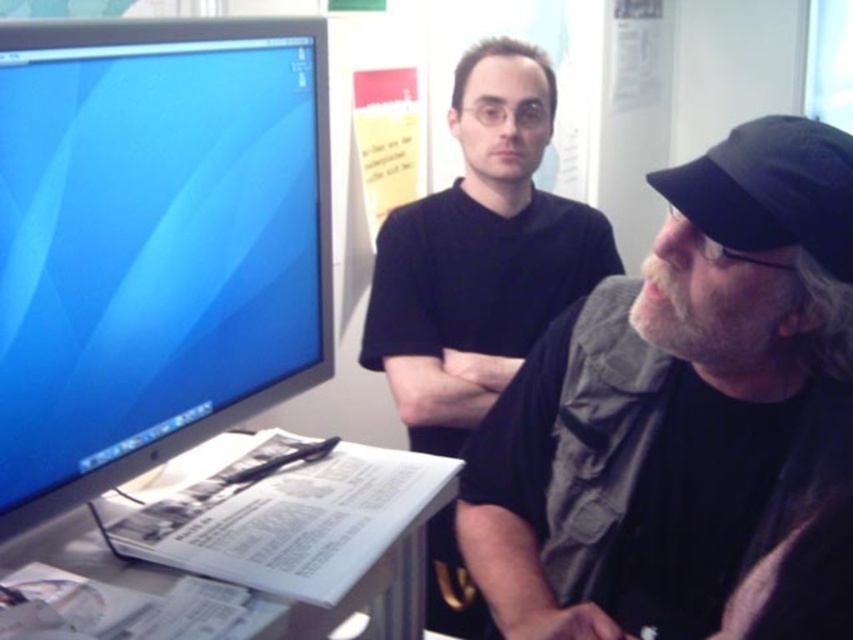
Is dark gray fabric shirt at center shorter than white paper at lower center?

Incorrect, dark gray fabric shirt at center's height does not fall short of white paper at lower center's.

Image resolution: width=853 pixels, height=640 pixels. I want to click on dark gray fabric shirt at center, so click(x=686, y=419).

Is point (677, 337) positioned after point (321, 634)?

No, (677, 337) is closer to viewer.

Locate an element on the screen. dark gray fabric shirt at center is located at coordinates (686, 419).

Measure the distance from dark gray fabric shirt at center to black matte shirt at center.

18.92 inches

Is point (566, 320) closer to viewer compared to point (474, 225)?

Yes, it is in front of point (474, 225).

Identify the location of dark gray fabric shirt at center. This screenshot has width=853, height=640. (686, 419).

Describe the element at coordinates (154, 243) in the screenshot. I see `matte plastic monitor at left` at that location.

Is matte plastic monitor at left taller than black matte shirt at center?

In fact, matte plastic monitor at left may be shorter than black matte shirt at center.

Locate an element on the screen. This screenshot has width=853, height=640. matte plastic monitor at left is located at coordinates (154, 243).

This screenshot has height=640, width=853. I want to click on matte plastic monitor at left, so click(x=154, y=243).